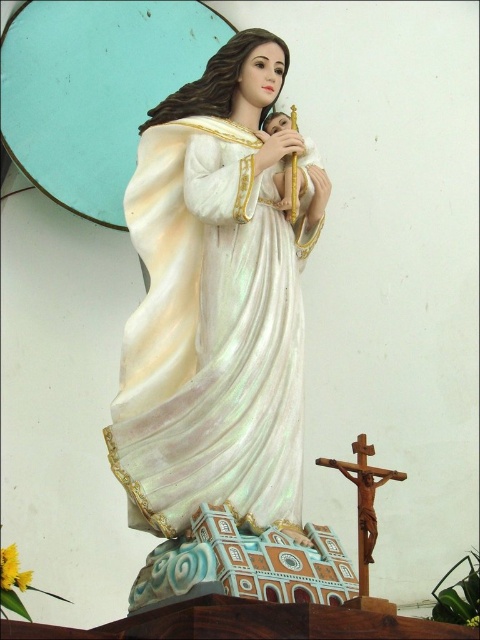
Does point (219, 502) come behind point (372, 548)?

No, (219, 502) is in front of (372, 548).

Who is positioned more to the left, iridescent fabric robe at center or wooden crucifix at lower right?

iridescent fabric robe at center

Is point (239, 296) farther from viewer compared to point (373, 529)?

Yes, it is.

I want to click on iridescent fabric robe at center, so click(211, 333).